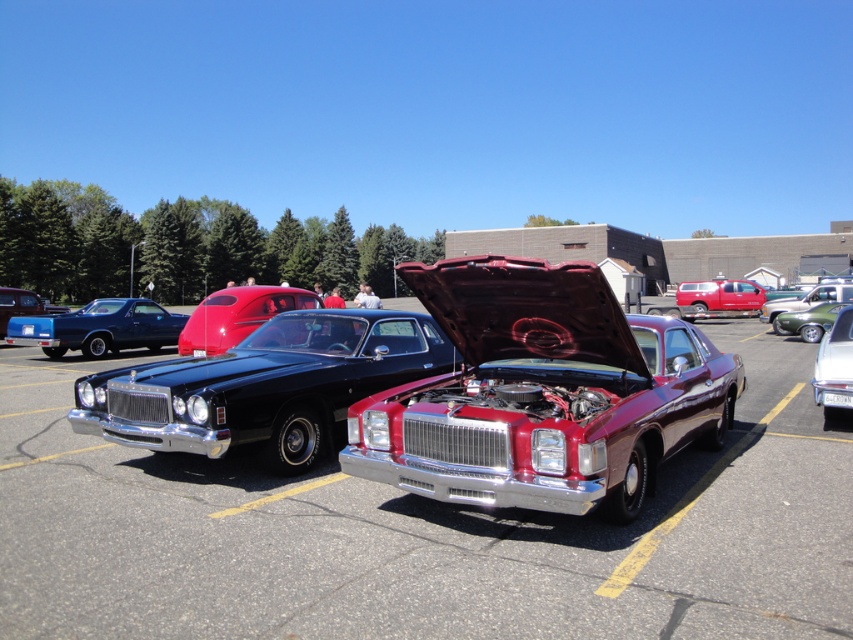
Question: Which of the following is the farthest from the observer?

Choices:
 (A) (70, 321)
 (B) (766, 301)
 (C) (849, 316)

Answer: (B)

Question: From the image, what is the correct spatial relationship of shiny metallic pickup truck at center in relation to glossy black car at center?

Choices:
 (A) right
 (B) left

Answer: (A)

Question: Estimate the real-world distances between objects in this image. Which object is closer to the glossy red car at center?

Choices:
 (A) shiny chrome car at center
 (B) silver metallic sedan at right
 (C) shiny metallic pickup truck at center

Answer: (A)

Question: Which point is closer to the camera?

Choices:
 (A) pos(784,298)
 (B) pos(155,442)
 (C) pos(820,337)

Answer: (B)

Question: Is shiny chrome car at center bigger than metallic green car at center?

Choices:
 (A) no
 (B) yes

Answer: (B)

Question: Does metallic red pickup truck at center appear over green metallic car at right?

Choices:
 (A) no
 (B) yes

Answer: (B)